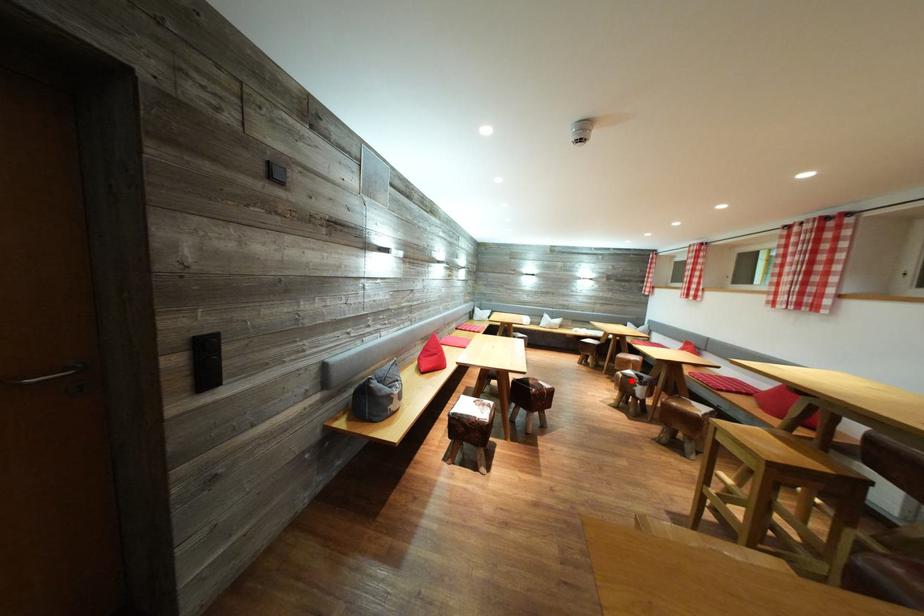
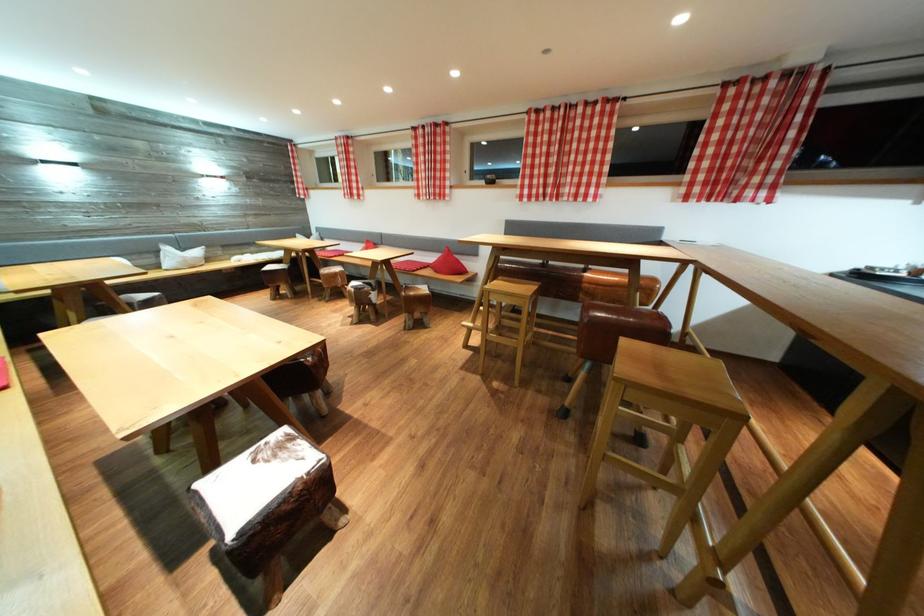
Question: I am providing you with two images of the same scene from different viewpoints. In image1, a red point is highlighted. Considering the same 3D point in image2, which of the following is correct?

Choices:
 (A) It is closer
 (B) It is farther

Answer: (B)